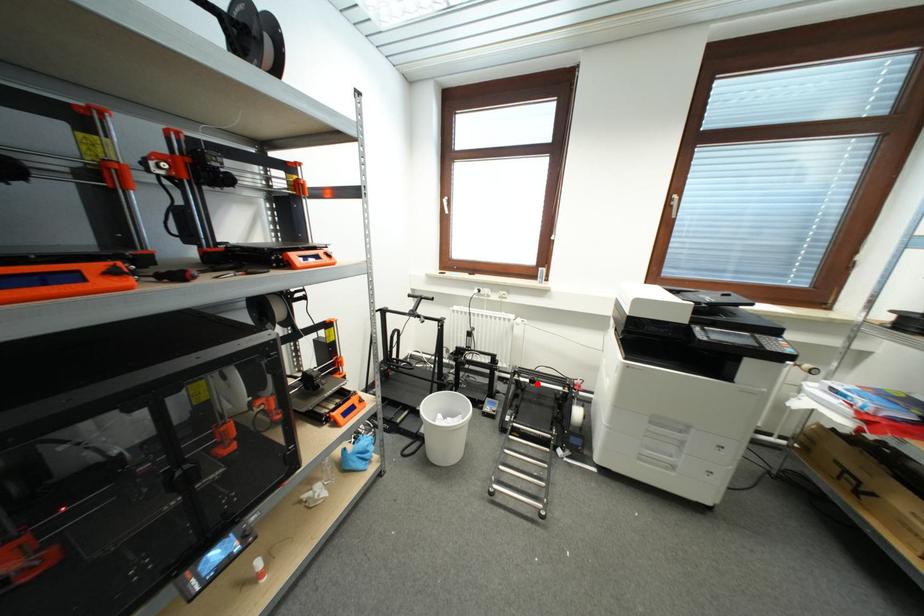
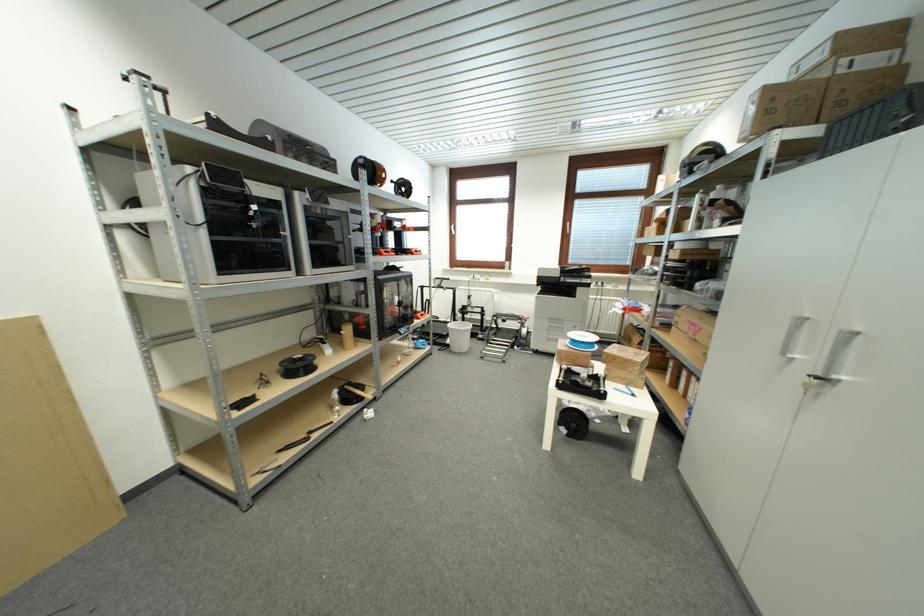
Find the pixel in the second image that matches the highlighted location in the first image.

(507, 323)